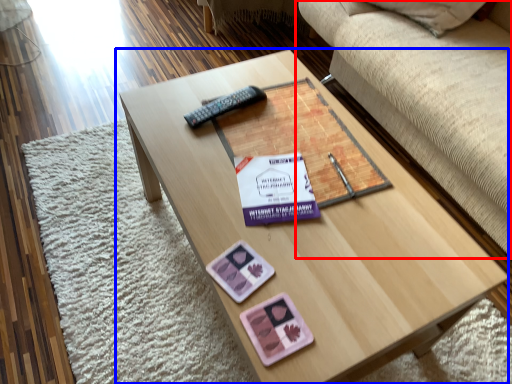
Question: Among these objects, which one is farthest to the camera, studio couch (highlighted by a red box) or coffee table (highlighted by a blue box)?

Choices:
 (A) studio couch
 (B) coffee table

Answer: (A)